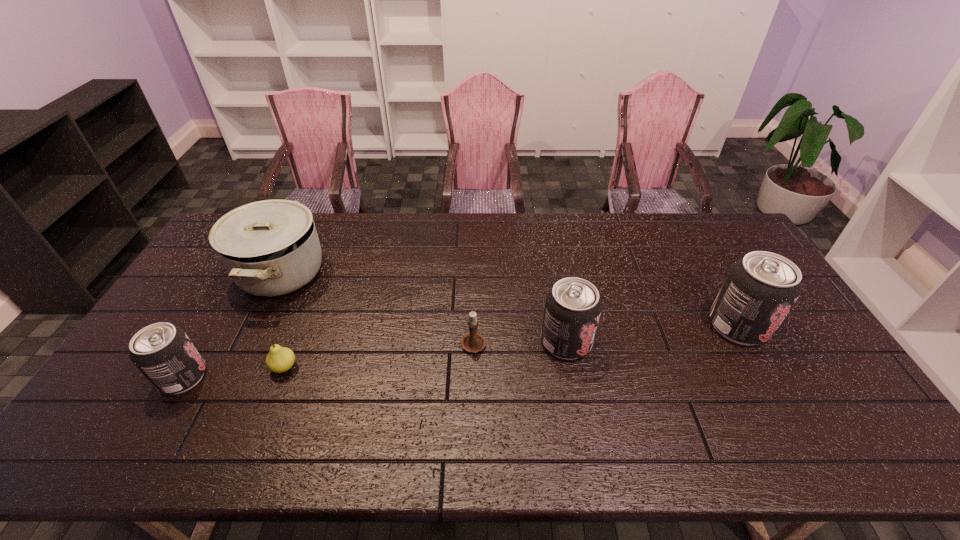
You are a GUI agent. You are given a task and a screenshot of the screen. Output one action in this format:
    pyautogui.click(x=<x>, y=<y>)
    Task: Click on the saucepan located in the left edge section of the desktop
    
    Given the screenshot: What is the action you would take?
    pyautogui.click(x=270, y=248)

Identify the location of object that is at the right edge. The image size is (960, 540). (760, 289).

Locate an element on the screen. object that is at the far left corner is located at coordinates (270, 248).

Locate an element on the screen. The height and width of the screenshot is (540, 960). object that is at the near left corner is located at coordinates (163, 353).

In the image, there is a desktop. Identify the location of free space at the far edge. (443, 234).

Find the location of a particular element. The height and width of the screenshot is (540, 960). free space at the near edge is located at coordinates (631, 400).

Where is `vacant space at the left edge of the desktop`? vacant space at the left edge of the desktop is located at coordinates (209, 273).

This screenshot has height=540, width=960. What are the coordinates of `free space at the near left corner` in the screenshot? It's located at (165, 401).

In the image, there is a desktop. What are the coordinates of `vacant space at the near right corner` in the screenshot? It's located at tap(835, 399).

What are the coordinates of `vacant point located between the candle holder and the rightmost object` in the screenshot? It's located at (606, 334).